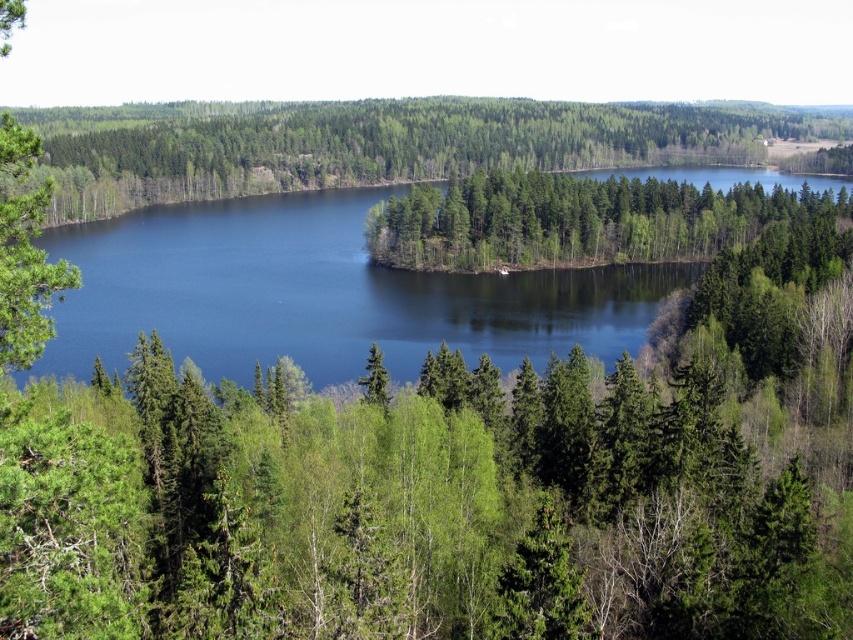
Is point (538, 218) farther from viewer compared to point (36, 285)?

Yes, point (538, 218) is farther from viewer.

Between green leafy trees at center and green matte tree at left, which one appears on the left side from the viewer's perspective?

green matte tree at left is more to the left.

Between point (445, 259) and point (12, 134), which one is positioned in front?

Point (12, 134) is in front.

You are a GUI agent. You are given a task and a screenshot of the screen. Output one action in this format:
    pyautogui.click(x=<x>, y=<y>)
    Task: Click on the green leafy trees at center
    The image size is (853, 640).
    Given the screenshot: What is the action you would take?
    pyautogui.click(x=573, y=220)

Between blue water at center and green leafy trees at center, which one is positioned lower?

Positioned lower is green leafy trees at center.

Is blue water at center to the left of green leafy trees at center from the viewer's perspective?

Indeed, blue water at center is positioned on the left side of green leafy trees at center.

Locate an element on the screen. This screenshot has width=853, height=640. blue water at center is located at coordinates (318, 294).

Which is in front, point (258, 332) or point (26, 230)?

Point (26, 230) is in front.

Is the position of blue water at center more distant than that of green matte tree at left?

That is True.

The height and width of the screenshot is (640, 853). Find the location of `blue water at center`. blue water at center is located at coordinates (318, 294).